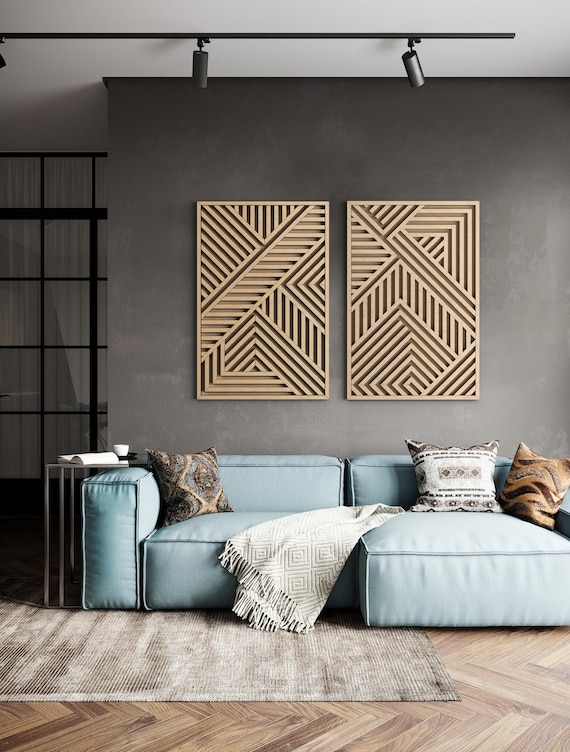
Locate an element on the screen. gray area rug is located at coordinates (149, 665).